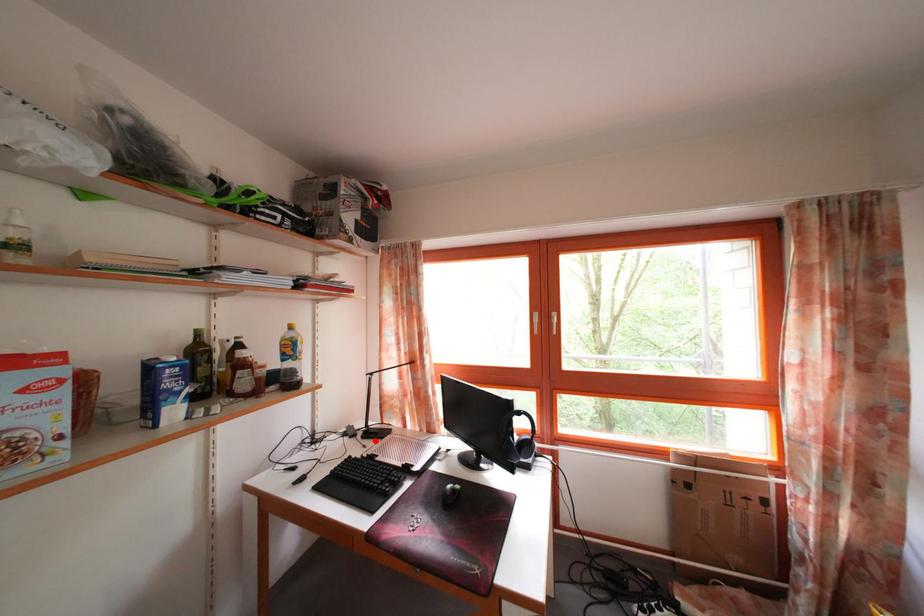
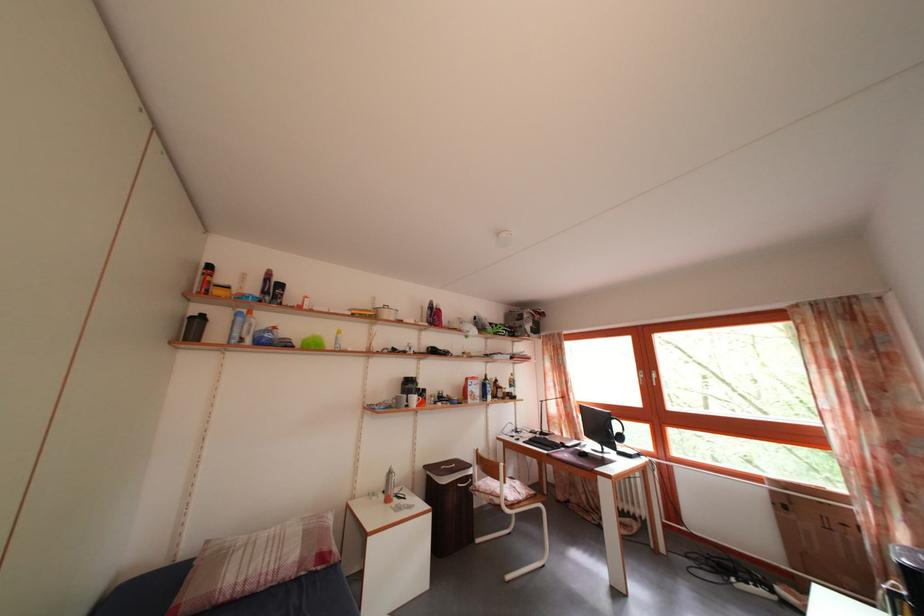
In the second image, find the point that corresponds to the highlighted location in the first image.

(550, 440)